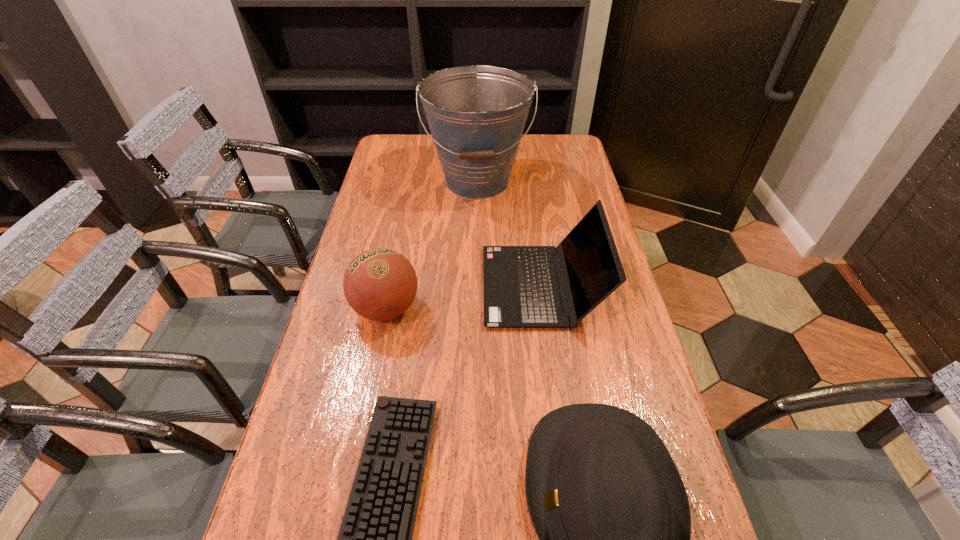
Locate an element on the screen. This screenshot has height=540, width=960. bucket is located at coordinates point(476,114).

What are the coordinates of `the tallest object` in the screenshot? It's located at (476, 114).

Image resolution: width=960 pixels, height=540 pixels. In order to click on laptop computer in this screenshot , I will do `click(521, 290)`.

Identify the location of basketball. (380, 284).

Identify the location of vacant space situated 0.360m with the handle on opposite sides of the farthest object. The image size is (960, 540). (476, 289).

The height and width of the screenshot is (540, 960). What are the coordinates of `free space located 0.230m on the screen of the laptop computer` in the screenshot? It's located at (401, 286).

Where is `free point located 0.190m on the screen of the laptop computer`? free point located 0.190m on the screen of the laptop computer is located at coordinates (416, 286).

What are the coordinates of `free space located on the screen of the laptop computer` in the screenshot? It's located at (455, 286).

Image resolution: width=960 pixels, height=540 pixels. What are the coordinates of `free space located on the back of the basketball` in the screenshot? It's located at [x=403, y=222].

The image size is (960, 540). What are the coordinates of `object that is at the far edge` in the screenshot? It's located at (476, 114).